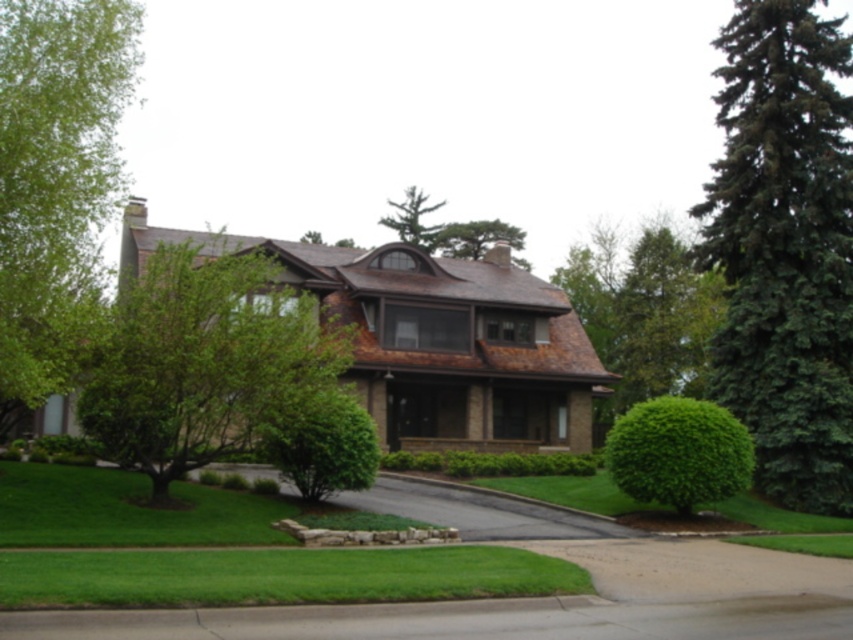
You are standing in the front yard of the house and want to walk from the green leafy tree at upper right to the green leafy bush at center right. Which direction should you move to get closer to the bush?

You should move towards the green leafy bush at center right by walking forward since the green leafy tree at upper right is closer to you than the bush, meaning the bush is behind the tree in the scene.

You are standing at the front yard of the house and see two points marked on the image. The first point is at coordinate point (x=840, y=189) and the second point is at coordinate point (x=434, y=244). Which point is closer to you?

Point (x=840, y=189) is in front of point (x=434, y=244), so the first point is closer to you.